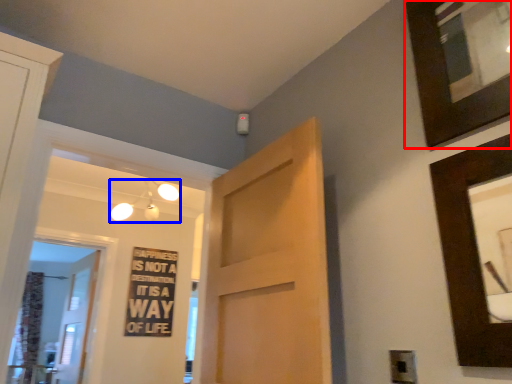
Question: Which point is further to the camera, picture frame (highlighted by a red box) or light fixture (highlighted by a blue box)?

Choices:
 (A) picture frame
 (B) light fixture

Answer: (B)